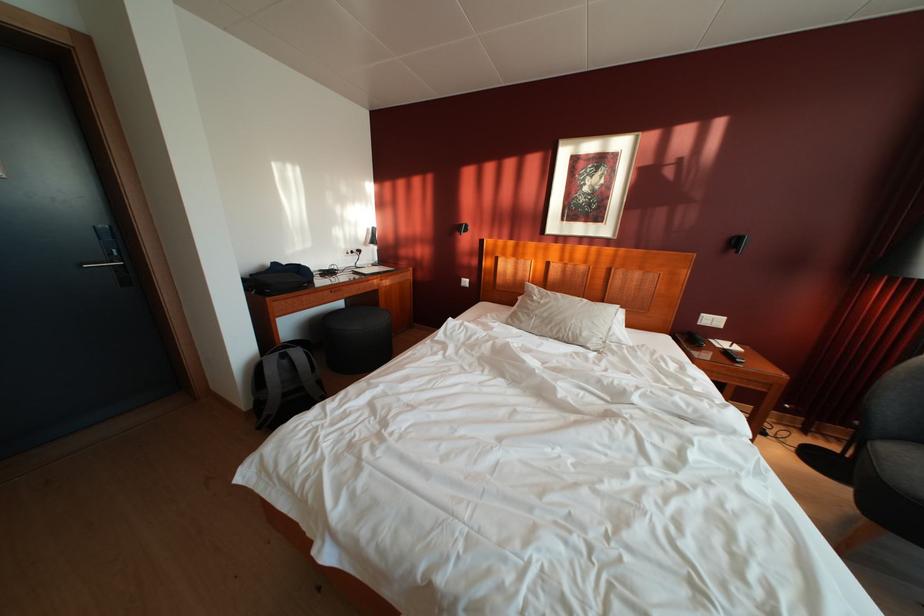
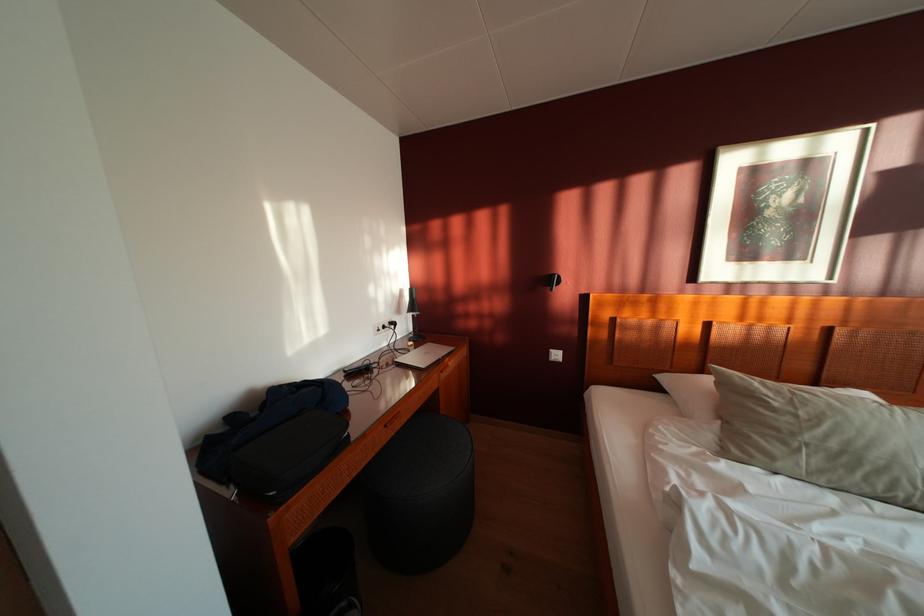
In the second image, find the point that corresponds to (x=355, y=302) in the first image.

(412, 424)